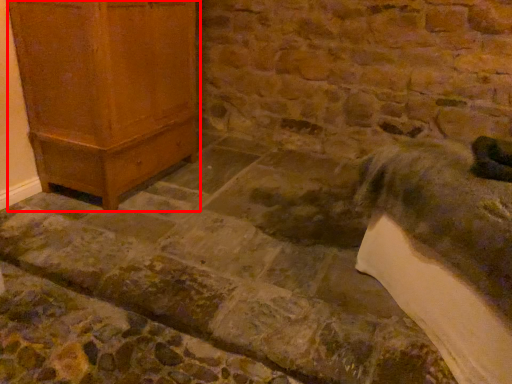
Question: Where is furniture (annotated by the red box) located in relation to animal in the image?

Choices:
 (A) right
 (B) left

Answer: (B)